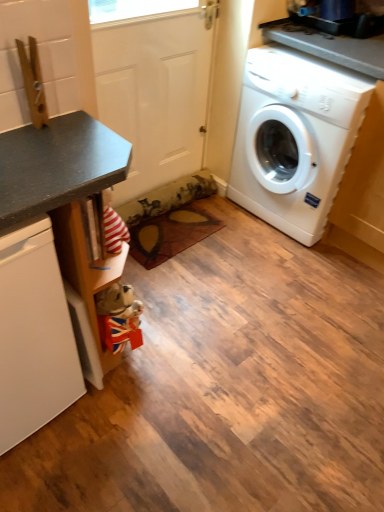
Question: Is white matte door at center not inside matte black counter at left?

Choices:
 (A) yes
 (B) no

Answer: (A)

Question: From a real-world perspective, is white matte door at center on top of matte black counter at left?

Choices:
 (A) yes
 (B) no

Answer: (A)

Question: Is matte black counter at left at the back of white matte door at center?

Choices:
 (A) yes
 (B) no

Answer: (B)

Question: Can you confirm if white matte door at center is taller than matte black counter at left?

Choices:
 (A) no
 (B) yes

Answer: (B)

Question: Does white matte door at center have a lesser width compared to matte black counter at left?

Choices:
 (A) yes
 (B) no

Answer: (A)

Question: Considering the positions of white plastic washing machine at right and white matte dishwasher at left in the image, is white plastic washing machine at right bigger or smaller than white matte dishwasher at left?

Choices:
 (A) small
 (B) big

Answer: (B)

Question: From the image's perspective, is white plastic washing machine at right located above or below white matte dishwasher at left?

Choices:
 (A) below
 (B) above

Answer: (B)

Question: Is white plastic washing machine at right wider or thinner than white matte dishwasher at left?

Choices:
 (A) wide
 (B) thin

Answer: (B)

Question: Considering the positions of point (249, 74) and point (74, 369), is point (249, 74) closer or farther from the camera than point (74, 369)?

Choices:
 (A) farther
 (B) closer

Answer: (A)

Question: Would you say matte black counter at left is inside or outside white matte dishwasher at left?

Choices:
 (A) inside
 (B) outside

Answer: (A)

Question: In terms of width, does matte black counter at left look wider or thinner when compared to white matte dishwasher at left?

Choices:
 (A) thin
 (B) wide

Answer: (B)

Question: From a real-world perspective, is matte black counter at left above or below white matte dishwasher at left?

Choices:
 (A) below
 (B) above

Answer: (B)

Question: From the image's perspective, is matte black counter at left located above or below white matte dishwasher at left?

Choices:
 (A) below
 (B) above

Answer: (B)

Question: Is white matte door at center bigger or smaller than white matte dishwasher at left?

Choices:
 (A) big
 (B) small

Answer: (B)

Question: Visually, is white matte door at center positioned to the left or to the right of white matte dishwasher at left?

Choices:
 (A) left
 (B) right

Answer: (B)